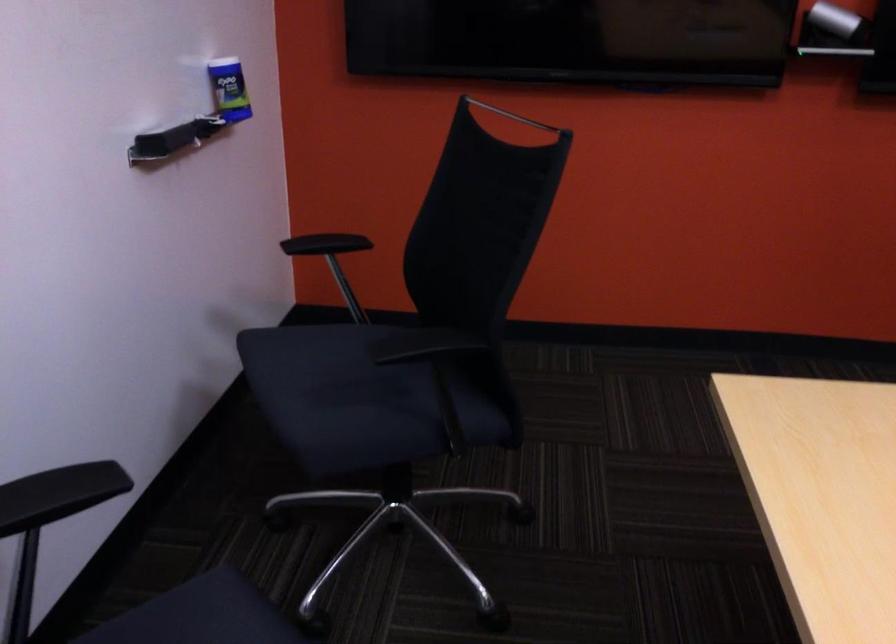
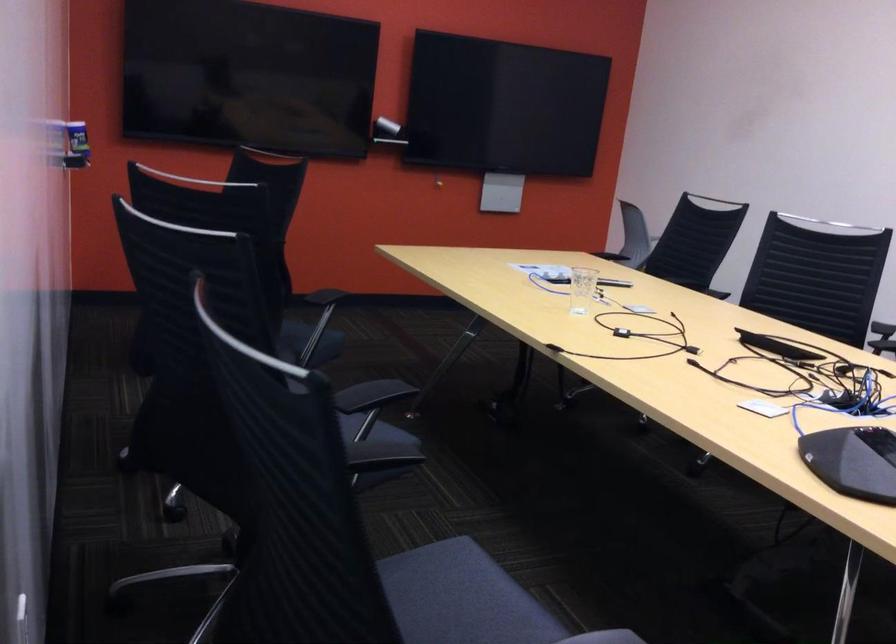
Locate, in the second image, the point that corresponds to the point at 207,128 in the first image.

(76, 145)